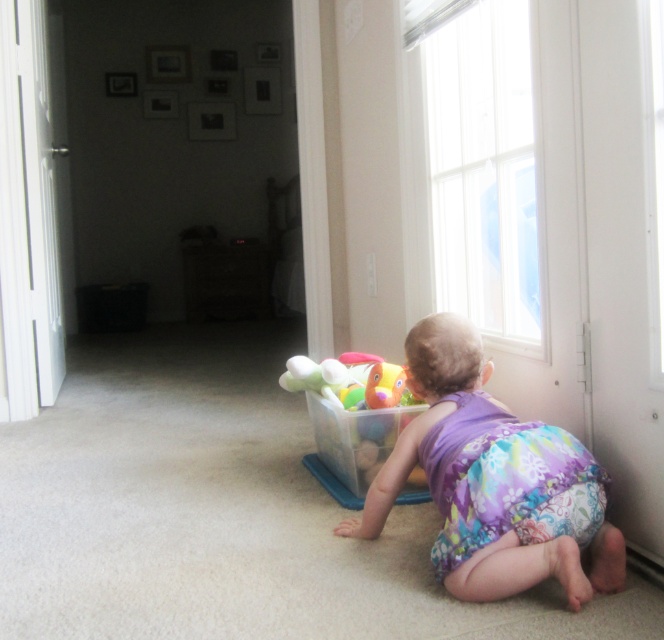
You are a parent in the room and want to pick up the purple floral fabric toddler at lower right without disturbing the translucent plastic container at center. Which direction should you approach from?

You should approach from the left side of the translucent plastic container at center because the purple floral fabric toddler at lower right is to the right of it, so moving from the left would avoid knocking over the container.

You are a photographer taking a picture of the baby in the scene. To ensure the floral fabric diaper at lower center is clearly visible in the photo, where should you focus your camera? Please provide coordinates based on the image grid system where the bottom left corner is 0,0 and the top right is 1,1.

The photographer should focus the camera at the coordinates point (517,492) where the floral fabric diaper at lower center is located.